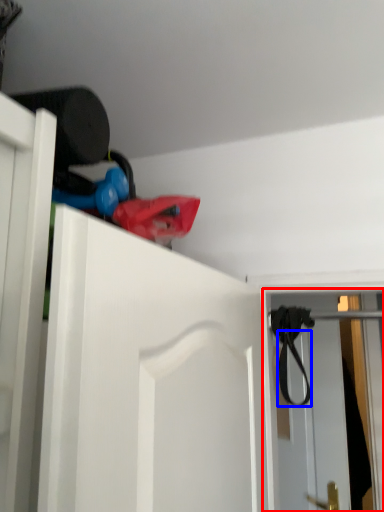
Question: Which object appears farthest to the camera in this image, screen door (highlighted by a red box) or strap (highlighted by a blue box)?

Choices:
 (A) screen door
 (B) strap

Answer: (A)